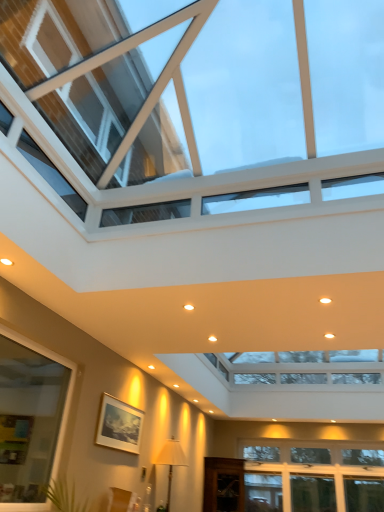
The height and width of the screenshot is (512, 384). Identify the location of clear glass window at lower left, the 2th window from the top. (31, 419).

Find the location of a particular element. The image size is (384, 512). white fabric lampshade at lower center is located at coordinates (171, 461).

Locate an element on the screen. matte silver picture frame at lower left is located at coordinates (119, 425).

Does transparent glass window at upper center, which ranks as the first window in top-to-bottom order, have a lesser width compared to white fabric lampshade at lower center?

No, transparent glass window at upper center, which ranks as the first window in top-to-bottom order, is not thinner than white fabric lampshade at lower center.

From the image's perspective, would you say transparent glass window at upper center, which ranks as the first window in top-to-bottom order, is shown under white fabric lampshade at lower center?

Actually, transparent glass window at upper center, which ranks as the first window in top-to-bottom order, appears above white fabric lampshade at lower center in the image.

Relative to white fabric lampshade at lower center, is transparent glass window at upper center, which ranks as the first window in top-to-bottom order, in front or behind?

Clearly, transparent glass window at upper center, which ranks as the first window in top-to-bottom order, is in front of white fabric lampshade at lower center.

Considering the positions of point (114, 407) and point (311, 501), is point (114, 407) closer or farther from the camera than point (311, 501)?

Clearly, point (114, 407) is closer to the camera than point (311, 501).

From the image's perspective, between matte silver picture frame at lower left and white glass window at lower right, the 1th window when ordered from bottom to top, which one is located above?

matte silver picture frame at lower left, from the image's perspective.

Who is smaller, matte silver picture frame at lower left or white glass window at lower right, the 1th window when ordered from bottom to top?

matte silver picture frame at lower left.

From a real-world perspective, which is physically below, matte silver picture frame at lower left or white glass window at lower right, which ranks as the third window in top-to-bottom order?

white glass window at lower right, which ranks as the third window in top-to-bottom order.

Can you tell me how much matte silver picture frame at lower left and clear glass window at lower left, the 2th window from the top, differ in facing direction?

0.000986 degrees.

From a real-world perspective, is matte silver picture frame at lower left physically located above or below clear glass window at lower left, the 2th window when ordered from bottom to top?

matte silver picture frame at lower left is above clear glass window at lower left, the 2th window when ordered from bottom to top.

From the image's perspective, is matte silver picture frame at lower left beneath clear glass window at lower left, the 2th window when ordered from bottom to top?

Yes.

Between point (141, 414) and point (16, 375), which one is positioned behind?

Positioned behind is point (141, 414).

From the picture: Is transparent glass window at upper center, placed as the 3th window when sorted from bottom to top, inside the boundaries of matte silver picture frame at lower left, or outside?

transparent glass window at upper center, placed as the 3th window when sorted from bottom to top, cannot be found inside matte silver picture frame at lower left.

Is transparent glass window at upper center, placed as the 3th window when sorted from bottom to top, wider or thinner than matte silver picture frame at lower left?

transparent glass window at upper center, placed as the 3th window when sorted from bottom to top, is wider than matte silver picture frame at lower left.

From the image's perspective, is transparent glass window at upper center, placed as the 3th window when sorted from bottom to top, over matte silver picture frame at lower left?

Yes, from the image's perspective, transparent glass window at upper center, placed as the 3th window when sorted from bottom to top, is on top of matte silver picture frame at lower left.

Consider the image. Which is more to the right, transparent glass window at upper center, placed as the 3th window when sorted from bottom to top, or matte silver picture frame at lower left?

transparent glass window at upper center, placed as the 3th window when sorted from bottom to top.

From the image's perspective, is transparent wooden cabinet at lower center under transparent glass window at upper center, which ranks as the first window in top-to-bottom order?

Yes, from the image's perspective, transparent wooden cabinet at lower center is beneath transparent glass window at upper center, which ranks as the first window in top-to-bottom order.

Does transparent wooden cabinet at lower center have a larger size compared to transparent glass window at upper center, placed as the 3th window when sorted from bottom to top?

Actually, transparent wooden cabinet at lower center might be smaller than transparent glass window at upper center, placed as the 3th window when sorted from bottom to top.

Which object is positioned more to the right, transparent wooden cabinet at lower center or transparent glass window at upper center, which ranks as the first window in top-to-bottom order?

From the viewer's perspective, transparent glass window at upper center, which ranks as the first window in top-to-bottom order, appears more on the right side.

Could you tell me if white glass window at lower right, which ranks as the third window in top-to-bottom order, is facing transparent wooden cabinet at lower center?

Yes, white glass window at lower right, which ranks as the third window in top-to-bottom order, is oriented towards transparent wooden cabinet at lower center.

Considering the sizes of objects white glass window at lower right, which ranks as the third window in top-to-bottom order, and transparent wooden cabinet at lower center in the image provided, who is shorter, white glass window at lower right, which ranks as the third window in top-to-bottom order, or transparent wooden cabinet at lower center?

With less height is transparent wooden cabinet at lower center.

Does white glass window at lower right, which ranks as the third window in top-to-bottom order, contain transparent wooden cabinet at lower center?

No.

Based on their sizes in the image, would you say transparent glass window at upper center, placed as the 3th window when sorted from bottom to top, is bigger or smaller than clear glass window at lower left, the 2th window from the top?

Clearly, transparent glass window at upper center, placed as the 3th window when sorted from bottom to top, is larger in size than clear glass window at lower left, the 2th window from the top.

What's the angular difference between transparent glass window at upper center, which ranks as the first window in top-to-bottom order, and clear glass window at lower left, the 2th window when ordered from bottom to top,'s facing directions?

transparent glass window at upper center, which ranks as the first window in top-to-bottom order, and clear glass window at lower left, the 2th window when ordered from bottom to top, are facing 180 degrees away from each other.

Based on the photo, from a real-world perspective, between transparent glass window at upper center, placed as the 3th window when sorted from bottom to top, and clear glass window at lower left, the 2th window when ordered from bottom to top, who is vertically lower?

From a 3D spatial view, clear glass window at lower left, the 2th window when ordered from bottom to top, is below.

Who is shorter, transparent glass window at upper center, which ranks as the first window in top-to-bottom order, or clear glass window at lower left, the 2th window from the top?

transparent glass window at upper center, which ranks as the first window in top-to-bottom order, is shorter.

From a real-world perspective, which window is the 3rd one above the white fabric lampshade at lower center? Please provide its 2D coordinates.

[(201, 97)]

Where is `window behind the matte silver picture frame at lower left`? window behind the matte silver picture frame at lower left is located at coordinates (313, 476).

Looking at the image, which one is located closer to white glass window at lower right, which ranks as the third window in top-to-bottom order, white fabric lampshade at lower center or transparent wooden cabinet at lower center?

transparent wooden cabinet at lower center.

From the image, which object appears to be farther from white fabric lampshade at lower center, white glass window at lower right, the 1th window when ordered from bottom to top, or transparent glass window at upper center, placed as the 3th window when sorted from bottom to top?

Among the two, transparent glass window at upper center, placed as the 3th window when sorted from bottom to top, is located further to white fabric lampshade at lower center.

Estimate the real-world distances between objects in this image. Which object is closer to white fabric lampshade at lower center, clear glass window at lower left, the 2th window from the top, or transparent wooden cabinet at lower center?

clear glass window at lower left, the 2th window from the top, is positioned closer to the anchor white fabric lampshade at lower center.

When comparing their distances from transparent wooden cabinet at lower center, does white fabric lampshade at lower center or clear glass window at lower left, the 2th window from the top, seem further?

clear glass window at lower left, the 2th window from the top.

From the image, which object appears to be nearer to transparent wooden cabinet at lower center, white fabric lampshade at lower center or matte silver picture frame at lower left?

white fabric lampshade at lower center is positioned closer to the anchor transparent wooden cabinet at lower center.

Based on their spatial positions, is white fabric lampshade at lower center or clear glass window at lower left, the 2th window when ordered from bottom to top, further from white glass window at lower right, the 1th window when ordered from bottom to top?

clear glass window at lower left, the 2th window when ordered from bottom to top, is further to white glass window at lower right, the 1th window when ordered from bottom to top.

Based on the photo, estimate the real-world distances between objects in this image. Which object is closer to transparent wooden cabinet at lower center, white fabric lampshade at lower center or transparent glass window at upper center, which ranks as the first window in top-to-bottom order?

Among the two, white fabric lampshade at lower center is located nearer to transparent wooden cabinet at lower center.

When comparing their distances from white glass window at lower right, the 1th window when ordered from bottom to top, does transparent wooden cabinet at lower center or white fabric lampshade at lower center seem further?

white fabric lampshade at lower center.

The image size is (384, 512). Find the location of `lamp between clear glass window at lower left, the 2th window from the top, and white glass window at lower right, the 1th window when ordered from bottom to top, in the front-back direction`. lamp between clear glass window at lower left, the 2th window from the top, and white glass window at lower right, the 1th window when ordered from bottom to top, in the front-back direction is located at coordinates (171, 461).

Where is `picture frame located between transparent glass window at upper center, placed as the 3th window when sorted from bottom to top, and transparent wooden cabinet at lower center in the depth direction`? The height and width of the screenshot is (512, 384). picture frame located between transparent glass window at upper center, placed as the 3th window when sorted from bottom to top, and transparent wooden cabinet at lower center in the depth direction is located at coordinates (119, 425).

In order to click on window positioned between transparent glass window at upper center, which ranks as the first window in top-to-bottom order, and matte silver picture frame at lower left from near to far in this screenshot , I will do `click(31, 419)`.

You are a GUI agent. You are given a task and a screenshot of the screen. Output one action in this format:
    pyautogui.click(x=<x>, y=<y>)
    Task: Click on the picture frame between clear glass window at lower left, the 2th window from the top, and white glass window at lower right, which ranks as the third window in top-to-bottom order, in the front-back direction
    This screenshot has width=384, height=512.
    Given the screenshot: What is the action you would take?
    pyautogui.click(x=119, y=425)